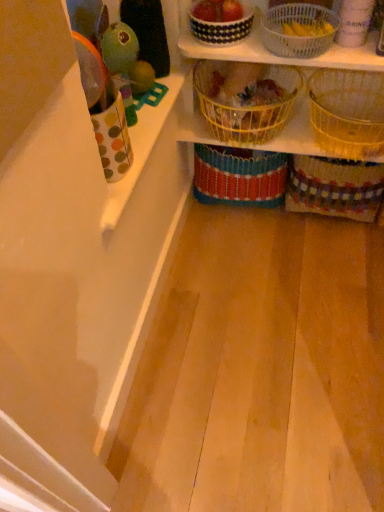
Question: Which direction should I rotate to look at black and white checkered basket at upper center, which ranks as the 6th basket in right-to-left order, — up or down?

Choices:
 (A) down
 (B) up

Answer: (B)

Question: Should I look upward or downward to see polka dot fabric cup at left?

Choices:
 (A) up
 (B) down

Answer: (A)

Question: Does white woven basket at upper center, the 3th basket when ordered from right to left, have a smaller size compared to black and white checkered basket at upper center, which ranks as the 6th basket in right-to-left order?

Choices:
 (A) no
 (B) yes

Answer: (A)

Question: Is white woven basket at upper center, the 3th basket when ordered from right to left, aimed at black and white checkered basket at upper center, which ranks as the 6th basket in right-to-left order?

Choices:
 (A) yes
 (B) no

Answer: (B)

Question: From the image's perspective, would you say white woven basket at upper center, the 3th basket when ordered from right to left, is shown under black and white checkered basket at upper center, which ranks as the 6th basket in right-to-left order?

Choices:
 (A) no
 (B) yes

Answer: (B)

Question: Considering the relative positions of white woven basket at upper center, the fourth basket positioned from the left, and black and white checkered basket at upper center, the 1th basket viewed from the left, in the image provided, is white woven basket at upper center, the fourth basket positioned from the left, to the left of black and white checkered basket at upper center, the 1th basket viewed from the left, from the viewer's perspective?

Choices:
 (A) no
 (B) yes

Answer: (A)

Question: Can you confirm if white woven basket at upper center, the 3th basket when ordered from right to left, is wider than black and white checkered basket at upper center, the 1th basket viewed from the left?

Choices:
 (A) yes
 (B) no

Answer: (A)

Question: Is white woven basket at upper center, the 3th basket when ordered from right to left, facing away from black and white checkered basket at upper center, the 1th basket viewed from the left?

Choices:
 (A) yes
 (B) no

Answer: (B)

Question: Is woven yellow basket at upper right, which is counted as the fifth basket, starting from the left, turned away from multicolored woven basket at lower right, which appears as the 1th basket when viewed from the right?

Choices:
 (A) no
 (B) yes

Answer: (A)

Question: Considering the relative sizes of woven yellow basket at upper right, which is counted as the fifth basket, starting from the left, and multicolored woven basket at lower right, the 6th basket in the left-to-right sequence, in the image provided, is woven yellow basket at upper right, which is counted as the fifth basket, starting from the left, thinner than multicolored woven basket at lower right, the 6th basket in the left-to-right sequence,?

Choices:
 (A) yes
 (B) no

Answer: (B)

Question: Is woven yellow basket at upper right, which is counted as the fifth basket, starting from the left, next to multicolored woven basket at lower right, which appears as the 1th basket when viewed from the right, and touching it?

Choices:
 (A) yes
 (B) no

Answer: (B)

Question: Can you confirm if woven yellow basket at upper right, the 2th basket when ordered from right to left, is positioned to the right of multicolored woven basket at lower right, which appears as the 1th basket when viewed from the right?

Choices:
 (A) no
 (B) yes

Answer: (A)

Question: Can you confirm if woven yellow basket at upper right, which is counted as the fifth basket, starting from the left, is bigger than multicolored woven basket at lower right, which appears as the 1th basket when viewed from the right?

Choices:
 (A) yes
 (B) no

Answer: (B)

Question: From a real-world perspective, does woven yellow basket at upper right, which is counted as the fifth basket, starting from the left, sit lower than multicolored woven basket at lower right, which appears as the 1th basket when viewed from the right?

Choices:
 (A) no
 (B) yes

Answer: (A)

Question: Are yellow woven basket at center, which ranks as the fourth basket in right-to-left order, and white woven basket at upper center, the fourth basket positioned from the left, located far from each other?

Choices:
 (A) no
 (B) yes

Answer: (A)